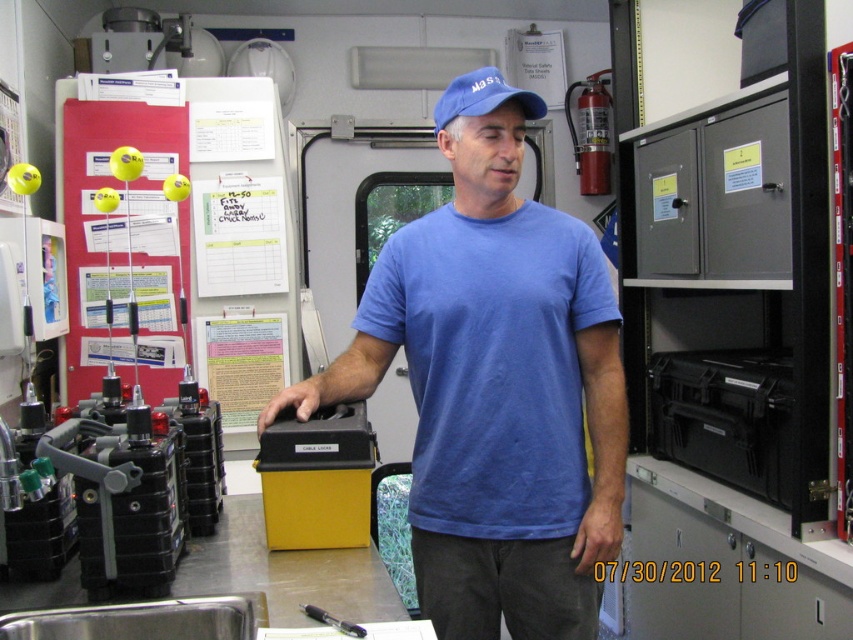
Is matte blue t-shirt at center smaller than blue fabric cap at center?

Actually, matte blue t-shirt at center might be larger than blue fabric cap at center.

Is matte blue t-shirt at center thinner than blue fabric cap at center?

No, matte blue t-shirt at center is not thinner than blue fabric cap at center.

The height and width of the screenshot is (640, 853). Describe the element at coordinates (492, 364) in the screenshot. I see `matte blue t-shirt at center` at that location.

Where is `matte blue t-shirt at center`? matte blue t-shirt at center is located at coordinates (492, 364).

Based on the photo, does blue cotton t-shirt at center have a greater width compared to matte blue t-shirt at center?

Yes, blue cotton t-shirt at center is wider than matte blue t-shirt at center.

Does blue cotton t-shirt at center come behind matte blue t-shirt at center?

No, blue cotton t-shirt at center is in front of matte blue t-shirt at center.

Which is behind, point (367, 353) or point (480, 392)?

The point (367, 353) is more distant.

At what (x,y) coordinates should I click in order to perform the action: click on blue cotton t-shirt at center. Please return your answer as a coordinate pair (x, y). The height and width of the screenshot is (640, 853). Looking at the image, I should click on (496, 396).

Locate an element on the screen. This screenshot has width=853, height=640. blue cotton t-shirt at center is located at coordinates (496, 396).

Between blue cotton t-shirt at center and blue fabric cap at center, which one is positioned higher?

blue fabric cap at center

Which is behind, point (473, 608) or point (465, 104)?

The point (473, 608) is more distant.

This screenshot has height=640, width=853. I want to click on blue cotton t-shirt at center, so click(x=496, y=396).